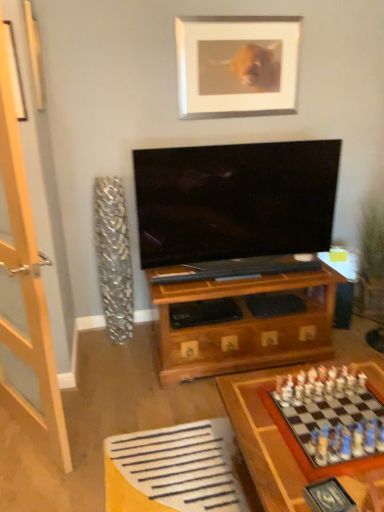
Question: Does clear glass door at left turn towards silver metallic picture frame at upper center?

Choices:
 (A) yes
 (B) no

Answer: (B)

Question: From the image's perspective, does clear glass door at left appear lower than silver metallic picture frame at upper center?

Choices:
 (A) no
 (B) yes

Answer: (B)

Question: Is clear glass door at left to the right of silver metallic picture frame at upper center from the viewer's perspective?

Choices:
 (A) yes
 (B) no

Answer: (B)

Question: Does clear glass door at left have a greater height compared to silver metallic picture frame at upper center?

Choices:
 (A) yes
 (B) no

Answer: (A)

Question: Is clear glass door at left thinner than silver metallic picture frame at upper center?

Choices:
 (A) yes
 (B) no

Answer: (B)

Question: From a real-world perspective, is clear glass door at left physically above silver metallic picture frame at upper center?

Choices:
 (A) no
 (B) yes

Answer: (A)

Question: Can you confirm if wooden chess set at lower right is thinner than silver metallic picture frame at upper center?

Choices:
 (A) no
 (B) yes

Answer: (A)

Question: Is wooden chess set at lower right outside silver metallic picture frame at upper center?

Choices:
 (A) yes
 (B) no

Answer: (A)

Question: Is wooden chess set at lower right surrounding silver metallic picture frame at upper center?

Choices:
 (A) no
 (B) yes

Answer: (A)

Question: From the image's perspective, is wooden chess set at lower right beneath silver metallic picture frame at upper center?

Choices:
 (A) yes
 (B) no

Answer: (A)

Question: Is wooden chess set at lower right oriented towards silver metallic picture frame at upper center?

Choices:
 (A) no
 (B) yes

Answer: (A)

Question: Considering the relative positions of wooden chess set at lower right and silver metallic picture frame at upper center in the image provided, is wooden chess set at lower right to the left of silver metallic picture frame at upper center from the viewer's perspective?

Choices:
 (A) yes
 (B) no

Answer: (B)

Question: Considering the relative sizes of clear glass door at left and wooden chessboard at lower right in the image provided, is clear glass door at left bigger than wooden chessboard at lower right?

Choices:
 (A) yes
 (B) no

Answer: (B)